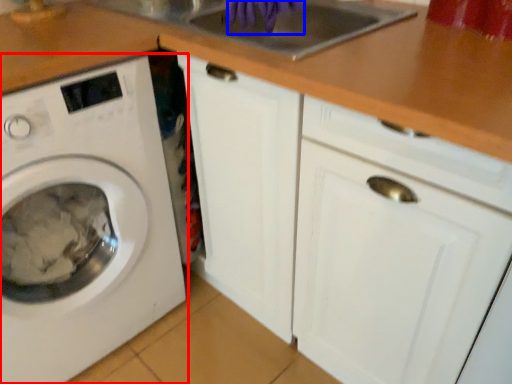
Question: Which point is closer to the camera, washing machine (highlighted by a red box) or hand (highlighted by a blue box)?

Choices:
 (A) washing machine
 (B) hand

Answer: (A)